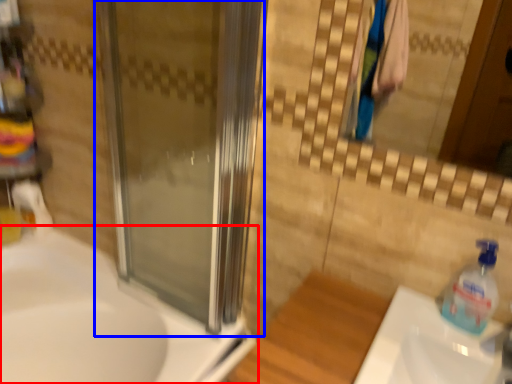
Question: Which of the following is the closest to the observer, sink (highlighted by a red box) or screen door (highlighted by a blue box)?

Choices:
 (A) sink
 (B) screen door

Answer: (B)